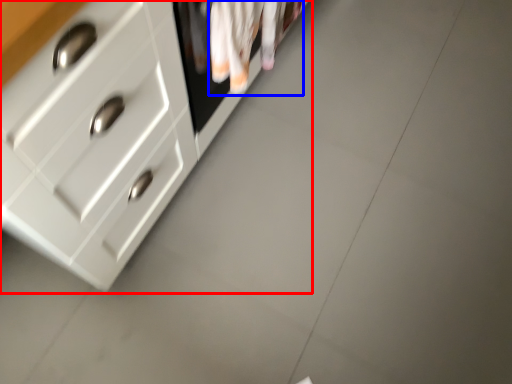
Question: Which object is further to the camera taking this photo, chest of drawers (highlighted by a red box) or laundry (highlighted by a blue box)?

Choices:
 (A) chest of drawers
 (B) laundry

Answer: (B)